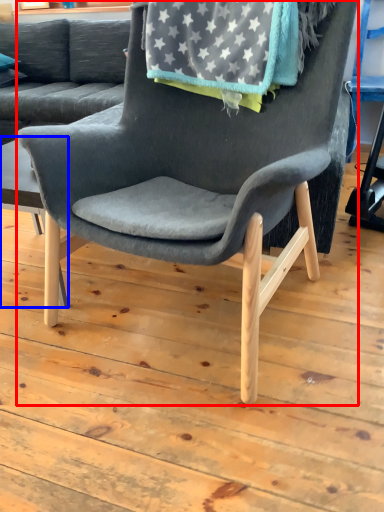
Question: Which of the following is the farthest to the observer, chair (highlighted by a red box) or table (highlighted by a blue box)?

Choices:
 (A) chair
 (B) table

Answer: (B)